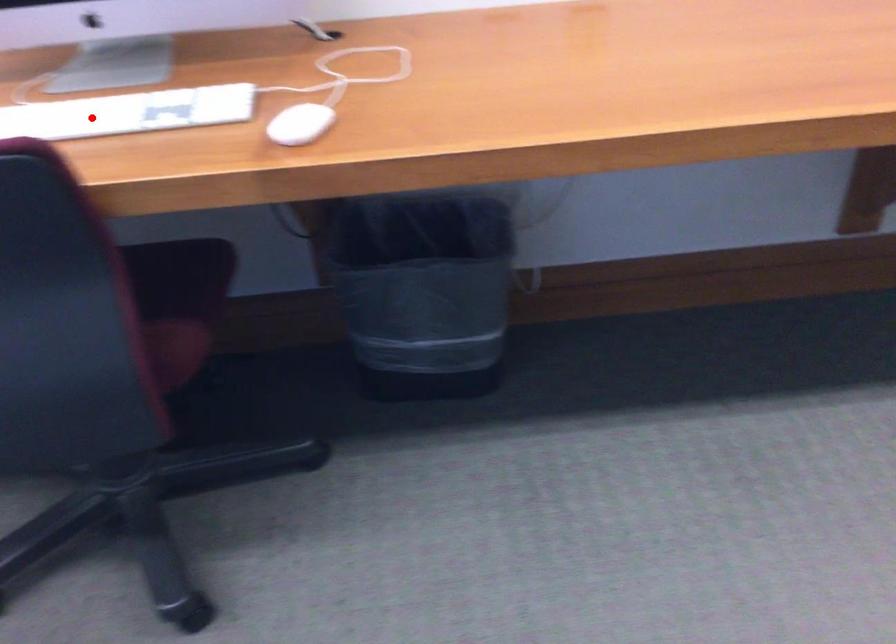
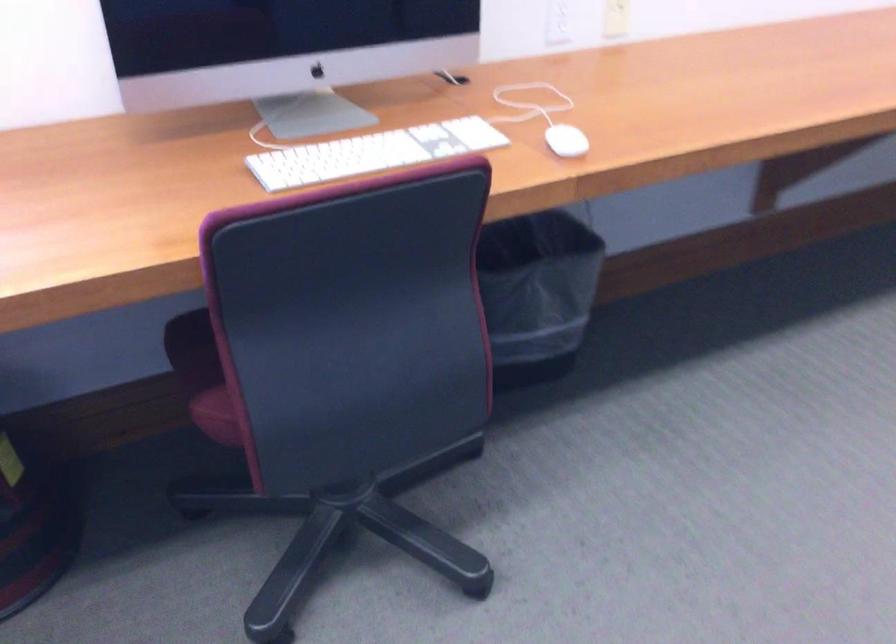
Question: I am providing you with two images of the same scene from different viewpoints. In image1, a red point is highlighted. Considering the same 3D point in image2, which of the following is correct?

Choices:
 (A) It is closer
 (B) It is farther

Answer: (B)